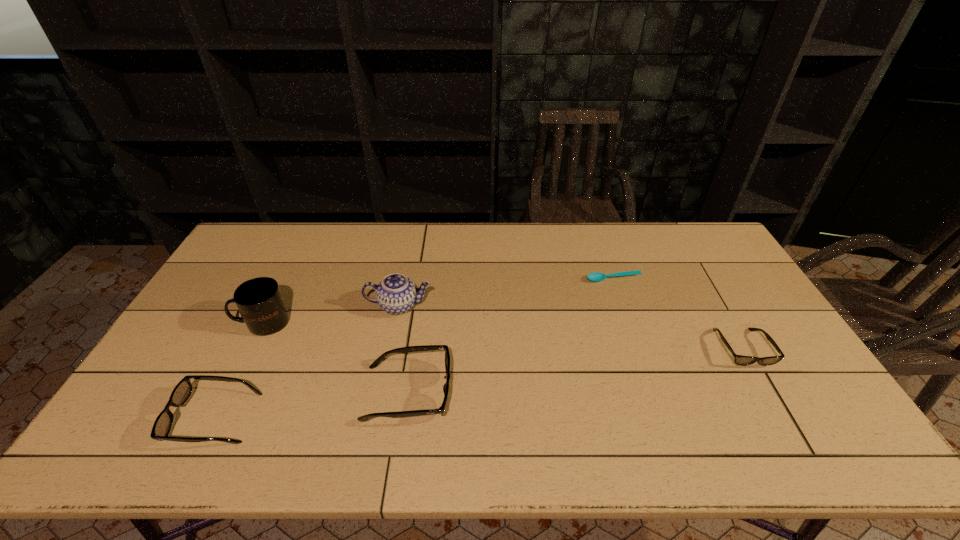
Locate an element on the screen. mug located at the left edge is located at coordinates (260, 302).

This screenshot has width=960, height=540. I want to click on object that is positioned at the right edge, so click(738, 359).

In order to click on object present at the near left corner in this screenshot , I will do `click(182, 391)`.

This screenshot has width=960, height=540. I want to click on vacant position at the far edge of the desktop, so click(x=450, y=256).

Locate an element on the screen. This screenshot has width=960, height=540. free space at the near edge of the desktop is located at coordinates (384, 409).

What are the coordinates of `vacant space at the right edge of the desktop` in the screenshot? It's located at (793, 362).

The image size is (960, 540). In order to click on vacant region at the far right corner in this screenshot , I will do `click(705, 231)`.

Image resolution: width=960 pixels, height=540 pixels. Find the location of `empty space between the tallest spectacles and the mug`. empty space between the tallest spectacles and the mug is located at coordinates (335, 357).

Identify the location of vacant space that is in between the farthest object and the second shortest object. This screenshot has height=540, width=960. (678, 314).

Where is `vacant space in between the mug and the second shortest spectacles`? vacant space in between the mug and the second shortest spectacles is located at coordinates (239, 370).